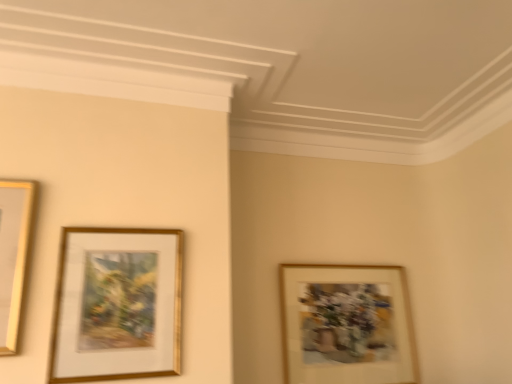
Question: From the image's perspective, does gold/glossy picture frame at lower left, the 1th picture frame from the front, appear lower than wooden picture frame at lower right, placed as the first picture frame when sorted from back to front?

Choices:
 (A) no
 (B) yes

Answer: (A)

Question: Is gold/glossy picture frame at lower left, the 2th picture frame from the right, at the left side of wooden picture frame at lower right, the 2th picture frame from the left?

Choices:
 (A) yes
 (B) no

Answer: (A)

Question: Are gold/glossy picture frame at lower left, the 2th picture frame in the back-to-front sequence, and wooden picture frame at lower right, placed as the first picture frame when sorted from back to front, far apart?

Choices:
 (A) yes
 (B) no

Answer: (B)

Question: Can we say gold/glossy picture frame at lower left, the 2th picture frame from the right, lies outside wooden picture frame at lower right, which appears as the 2th picture frame when viewed from the front?

Choices:
 (A) yes
 (B) no

Answer: (A)

Question: Is gold/glossy picture frame at lower left, the 2th picture frame from the right, aimed at wooden picture frame at lower right, placed as the first picture frame when sorted from back to front?

Choices:
 (A) no
 (B) yes

Answer: (A)

Question: From the image's perspective, does gold/glossy picture frame at lower left, the 2th picture frame from the right, appear higher than wooden picture frame at lower right, which appears as the 2th picture frame when viewed from the front?

Choices:
 (A) yes
 (B) no

Answer: (A)

Question: Would you consider wooden picture frame at lower right, placed as the first picture frame when sorted from back to front, to be distant from gold/glossy picture frame at lower left, which is the first picture frame in left-to-right order?

Choices:
 (A) no
 (B) yes

Answer: (A)

Question: Does wooden picture frame at lower right, placed as the first picture frame when sorted from back to front, appear on the right side of gold/glossy picture frame at lower left, which is the first picture frame in left-to-right order?

Choices:
 (A) yes
 (B) no

Answer: (A)

Question: Is wooden picture frame at lower right, positioned as the 1th picture frame in right-to-left order, to the left of gold/glossy picture frame at lower left, the 1th picture frame from the front, from the viewer's perspective?

Choices:
 (A) yes
 (B) no

Answer: (B)

Question: Is wooden picture frame at lower right, the 2th picture frame from the left, smaller than gold/glossy picture frame at lower left, the 2th picture frame from the right?

Choices:
 (A) no
 (B) yes

Answer: (A)

Question: Would you say wooden picture frame at lower right, positioned as the 1th picture frame in right-to-left order, is outside gold/glossy picture frame at lower left, the 1th picture frame from the front?

Choices:
 (A) yes
 (B) no

Answer: (A)

Question: Is wooden picture frame at lower right, the 2th picture frame from the left, closer to camera compared to gold/glossy picture frame at lower left, which is the first picture frame in left-to-right order?

Choices:
 (A) no
 (B) yes

Answer: (A)

Question: Does point (375, 327) appear closer or farther from the camera than point (73, 283)?

Choices:
 (A) farther
 (B) closer

Answer: (A)